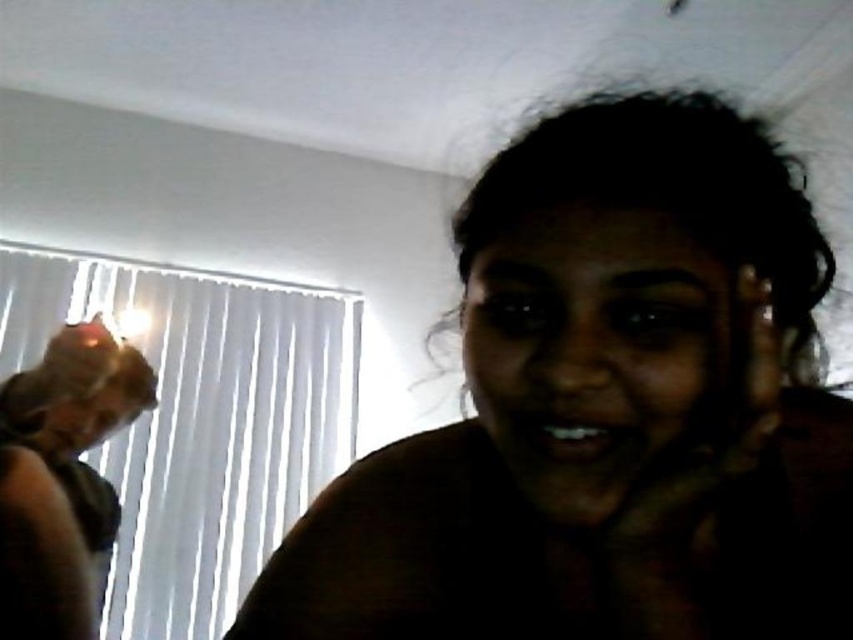
Does dark skin woman at center have a greater width compared to matte plastic face at left?

Yes, dark skin woman at center is wider than matte plastic face at left.

Is point (825, 497) positioned before point (45, 433)?

Yes, point (825, 497) is closer to viewer.

You are a GUI agent. You are given a task and a screenshot of the screen. Output one action in this format:
    pyautogui.click(x=<x>, y=<y>)
    Task: Click on the dark skin woman at center
    The height and width of the screenshot is (640, 853).
    Given the screenshot: What is the action you would take?
    pyautogui.click(x=606, y=410)

From the picture: Which is more to the right, dark skin woman at center or dark skin face at center?

dark skin woman at center

Who is taller, dark skin woman at center or dark skin face at center?

Standing taller between the two is dark skin woman at center.

Does point (386, 499) come closer to viewer compared to point (685, 464)?

No.

At what (x,y) coordinates should I click in order to perform the action: click on dark skin woman at center. Please return your answer as a coordinate pair (x, y). The width and height of the screenshot is (853, 640). Looking at the image, I should click on (606, 410).

Does point (821, 550) lie behind point (216, 566)?

That is False.

Between dark skin woman at center and white vertical blinds at left, which one is positioned lower?

white vertical blinds at left is lower down.

At what (x,y) coordinates should I click in order to perform the action: click on dark skin woman at center. Please return your answer as a coordinate pair (x, y). Looking at the image, I should click on (606, 410).